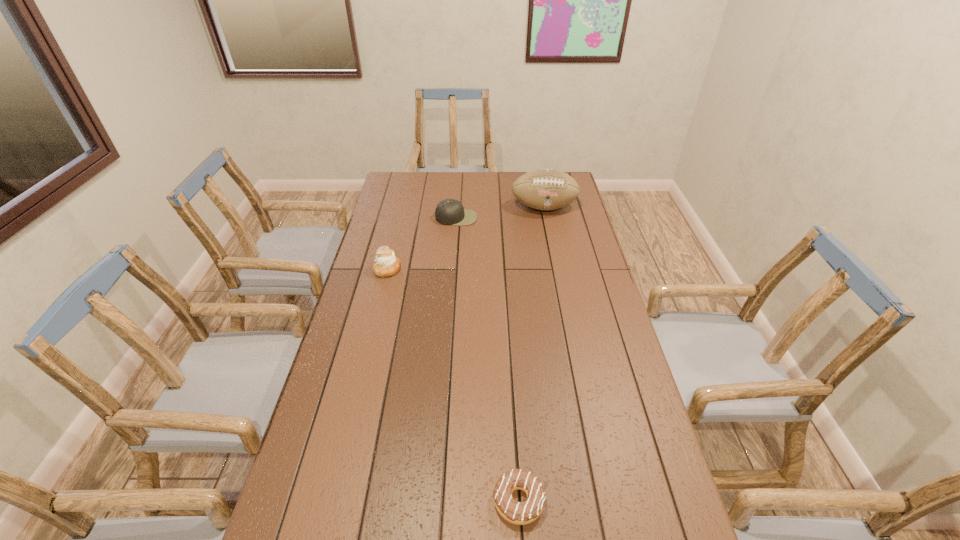
At what (x,y) coordinates should I click in order to perform the action: click on object situated at the left edge. Please return your answer as a coordinate pair (x, y). This screenshot has width=960, height=540. Looking at the image, I should click on (386, 264).

Identify the location of object that is at the right edge. pos(546,189).

Where is `vacant space at the far edge of the desktop`? Image resolution: width=960 pixels, height=540 pixels. vacant space at the far edge of the desktop is located at coordinates (510, 193).

In the image, there is a desktop. Where is `free space at the left edge`? This screenshot has height=540, width=960. free space at the left edge is located at coordinates (367, 407).

Identify the location of free region at the right edge. (557, 237).

Identify the location of free space between the second object from left to right and the pastry. (421, 244).

Locate an element on the screen. blank region between the second nearest object and the nearest object is located at coordinates (453, 385).

At what (x,y) coordinates should I click in order to perform the action: click on vacant space in between the leftmost object and the nearest object. Please return your answer as a coordinate pair (x, y). This screenshot has width=960, height=540. Looking at the image, I should click on (453, 385).

Identify the location of free point between the nearest object and the tallest object. (x=531, y=354).

Identify the location of free point between the doughnut and the pastry. (453, 385).